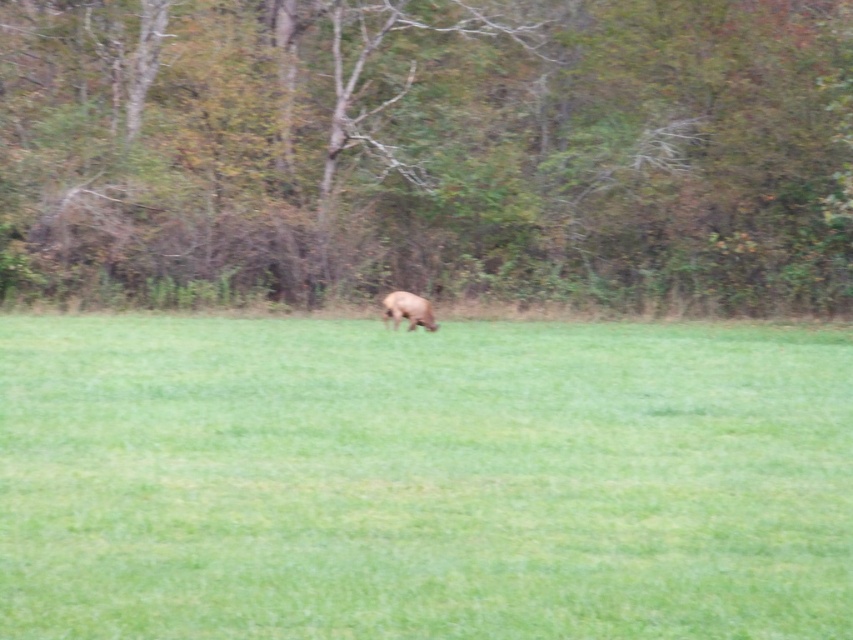
Who is higher up, green grassy field at center or brown leafy tree at center?

brown leafy tree at center is above.

Between green grassy field at center and brown leafy tree at center, which one appears on the right side from the viewer's perspective?

green grassy field at center is more to the right.

What do you see at coordinates (422, 480) in the screenshot? The height and width of the screenshot is (640, 853). I see `green grassy field at center` at bounding box center [422, 480].

You are a GUI agent. You are given a task and a screenshot of the screen. Output one action in this format:
    pyautogui.click(x=<x>, y=<y>)
    Task: Click on the green grassy field at center
    The image size is (853, 640).
    Given the screenshot: What is the action you would take?
    pyautogui.click(x=422, y=480)

Between point (567, 241) and point (412, 323), which one is positioned in front?

Point (412, 323) is more forward.

Can you confirm if brown leafy tree at center is shorter than brown furry dog at center?

No.

Is point (259, 96) behind point (383, 298)?

Yes, point (259, 96) is farther from viewer.

The height and width of the screenshot is (640, 853). I want to click on brown leafy tree at center, so click(428, 150).

Is point (224, 477) positioned before point (404, 312)?

That is True.

Does green grassy field at center have a smaller size compared to brown furry dog at center?

Actually, green grassy field at center might be larger than brown furry dog at center.

At what (x,y) coordinates should I click in order to perform the action: click on green grassy field at center. Please return your answer as a coordinate pair (x, y). Looking at the image, I should click on (422, 480).